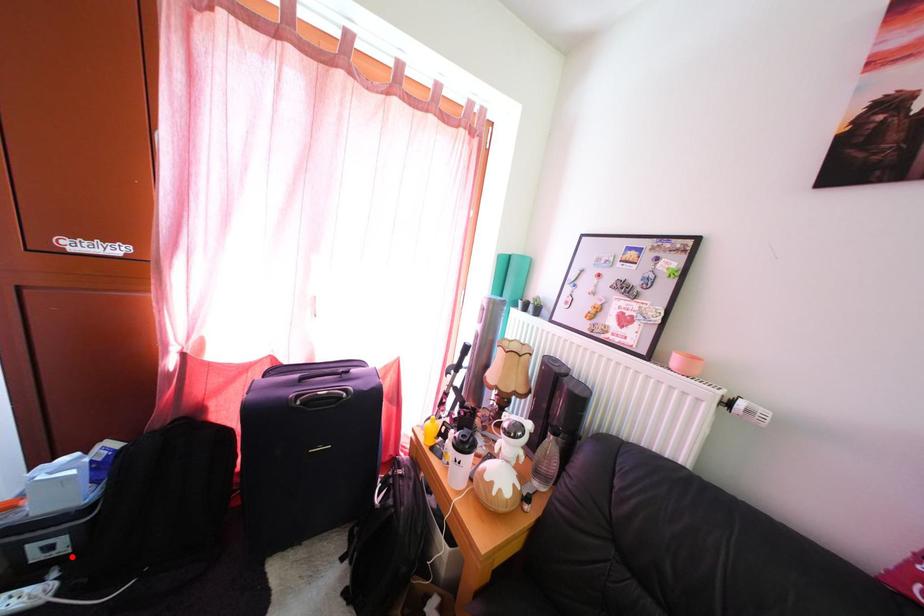
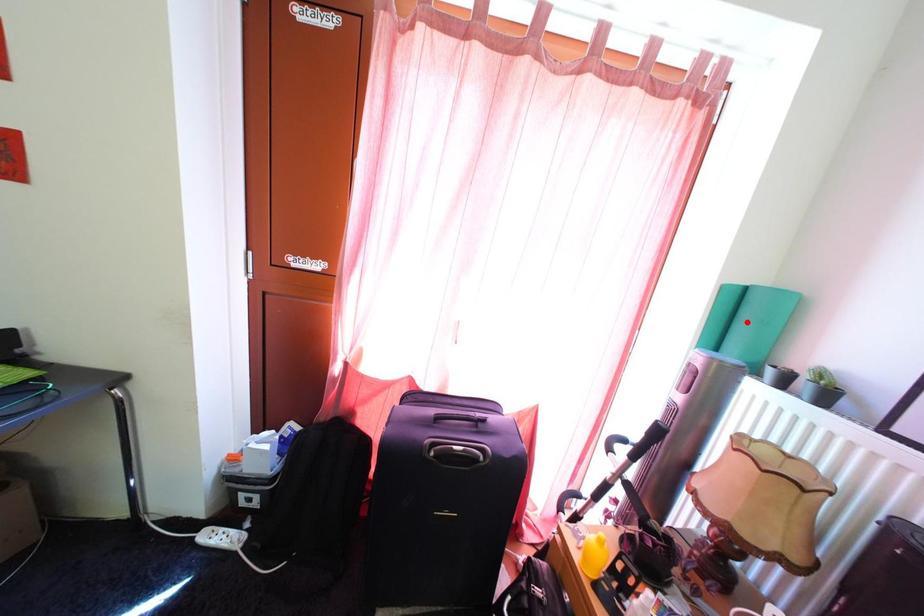
I am providing you with two images of the same scene from different viewpoints. A red point is marked on the first image and another point is marked on the second image. Is the marked point in image1 the same physical position as the marked point in image2?

No